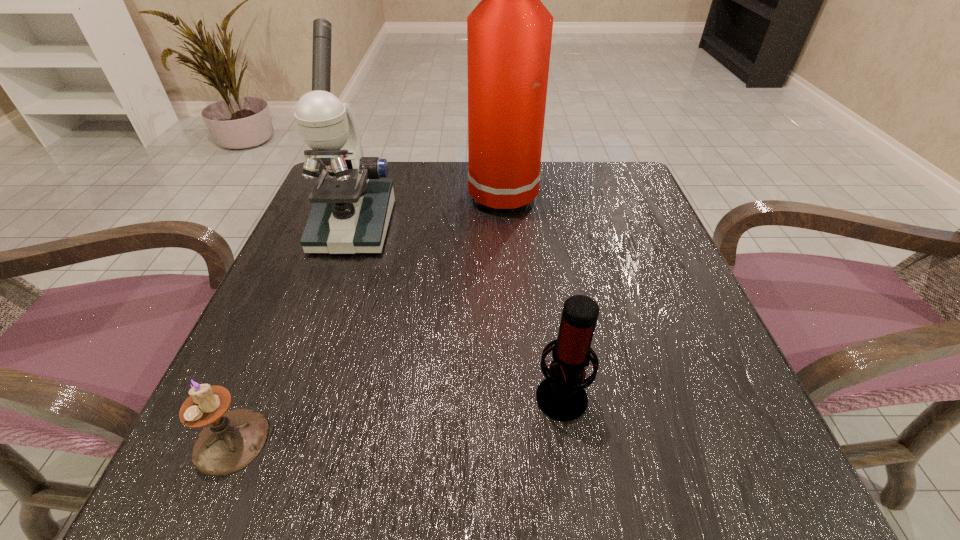
Find the location of a particular element. The width and height of the screenshot is (960, 540). fire extinguisher that is at the far edge is located at coordinates (509, 33).

Find the location of a particular element. Image resolution: width=960 pixels, height=540 pixels. microscope present at the far edge is located at coordinates (352, 206).

Identify the location of object situated at the near edge. (231, 440).

You are a GUI agent. You are given a task and a screenshot of the screen. Output one action in this format:
    pyautogui.click(x=<x>, y=<y>)
    Task: Click on the microscope at the left edge
    
    Given the screenshot: What is the action you would take?
    pyautogui.click(x=352, y=206)

Locate an element on the screen. This screenshot has width=960, height=540. candle holder positioned at the left edge is located at coordinates (231, 440).

You are a GUI agent. You are given a task and a screenshot of the screen. Output one action in this format:
    pyautogui.click(x=<x>, y=<y>)
    Task: Click on the object present at the far left corner
    This screenshot has width=960, height=540.
    Given the screenshot: What is the action you would take?
    pyautogui.click(x=352, y=206)

Identify the location of object at the near left corner. This screenshot has width=960, height=540. (231, 440).

Locate an element on the screen. free space at the far edge is located at coordinates (467, 195).

Find the location of a particular element. free space at the near edge is located at coordinates (350, 433).

In the image, there is a desktop. Find the location of `blank space at the left edge`. blank space at the left edge is located at coordinates (292, 334).